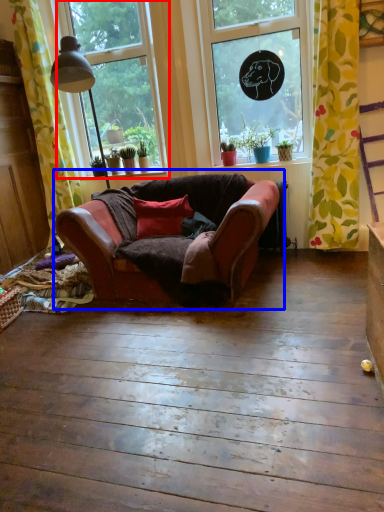
Question: Which of the following is the farthest to the observer, window (highlighted by a red box) or studio couch (highlighted by a blue box)?

Choices:
 (A) window
 (B) studio couch

Answer: (A)